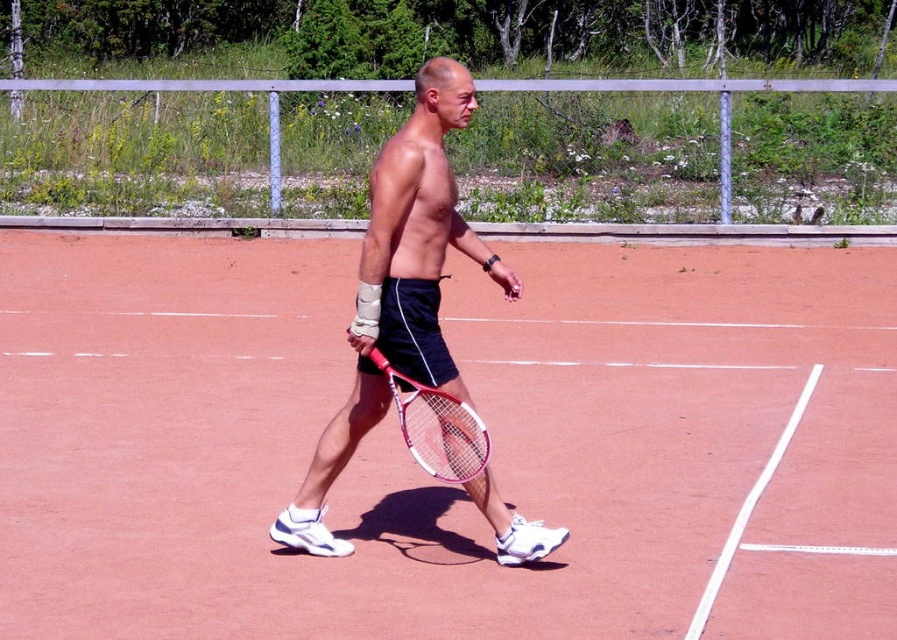
You are a tennis ball that just landed on the coral clay tennis court at center. You want to bounce back up to the white frame tennis racket at center. Considering their heights, will you be able to reach the racket?

The coral clay tennis court at center is taller than the white frame tennis racket at center. Since the court is higher, the tennis ball can bounce up to reach the racket.